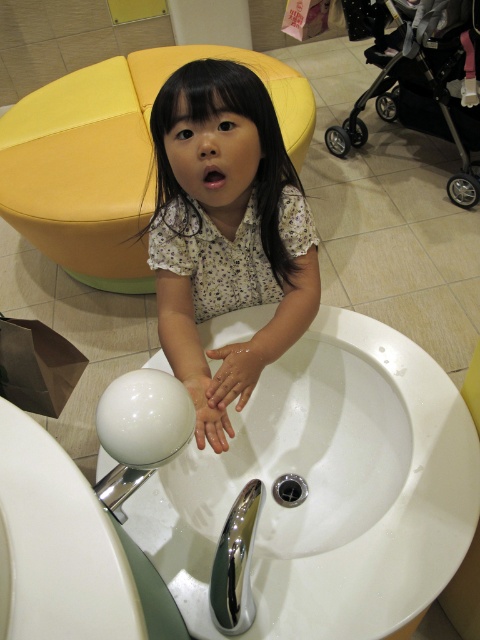
Question: Which point is closer to the camera?

Choices:
 (A) chrome metallic faucet at sink center
 (B) metallic stroller at upper right
 (C) white matte hand at sink center
 (D) white floral dress at center

Answer: (A)

Question: Which object is closer to the camera taking this photo?

Choices:
 (A) chrome metallic faucet at lower center
 (B) white glossy sink at center

Answer: (A)

Question: Where is white glossy sink at center located in relation to white matte hand at sink center in the image?

Choices:
 (A) right
 (B) left

Answer: (A)

Question: Is white matte hand at sink center below chrome metallic faucet at lower center?

Choices:
 (A) yes
 (B) no

Answer: (B)

Question: Which object is the closest to the white matte hand at sink center?

Choices:
 (A) white floral dress at center
 (B) metallic stroller at upper right
 (C) chrome metallic faucet at sink center
 (D) white glossy sink at center

Answer: (C)

Question: Can you confirm if white matte hand at sink center is wider than chrome metallic faucet at lower center?

Choices:
 (A) no
 (B) yes

Answer: (B)